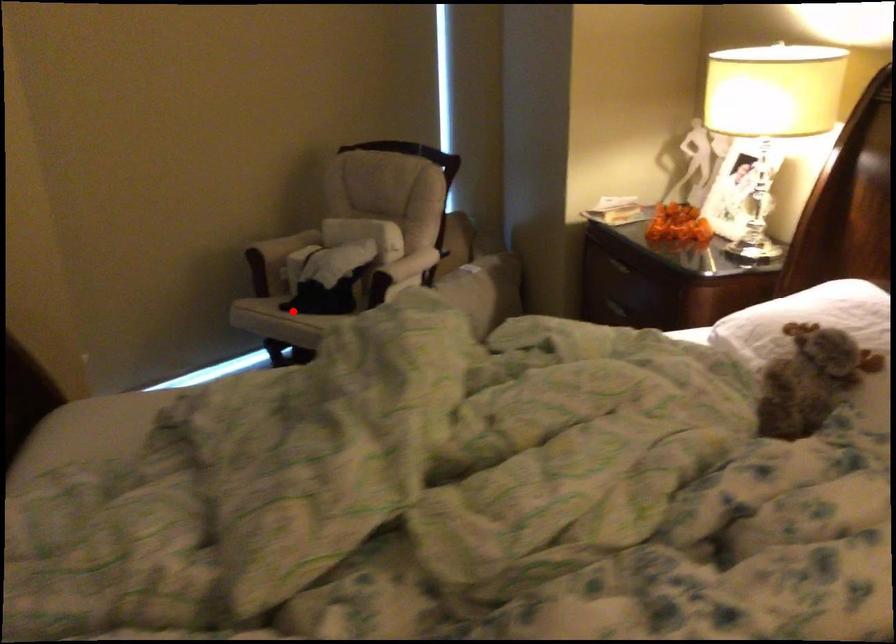
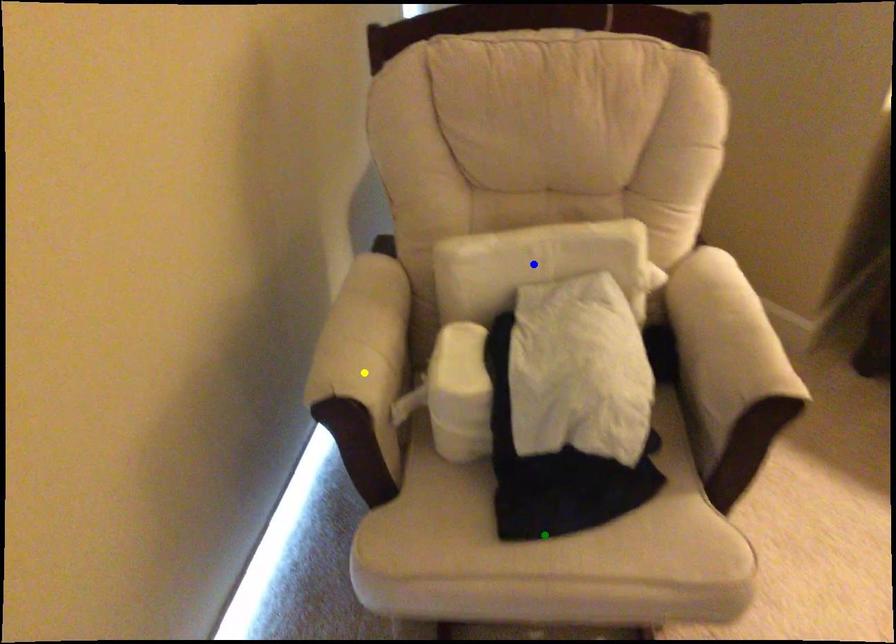
Question: I am providing you with two images of the same scene from different viewpoints. A red point is marked on the first image. You are given multiple points on the second image. Which mark in image 2 goes with the point in image 1?

Choices:
 (A) blue point
 (B) green point
 (C) yellow point

Answer: (B)